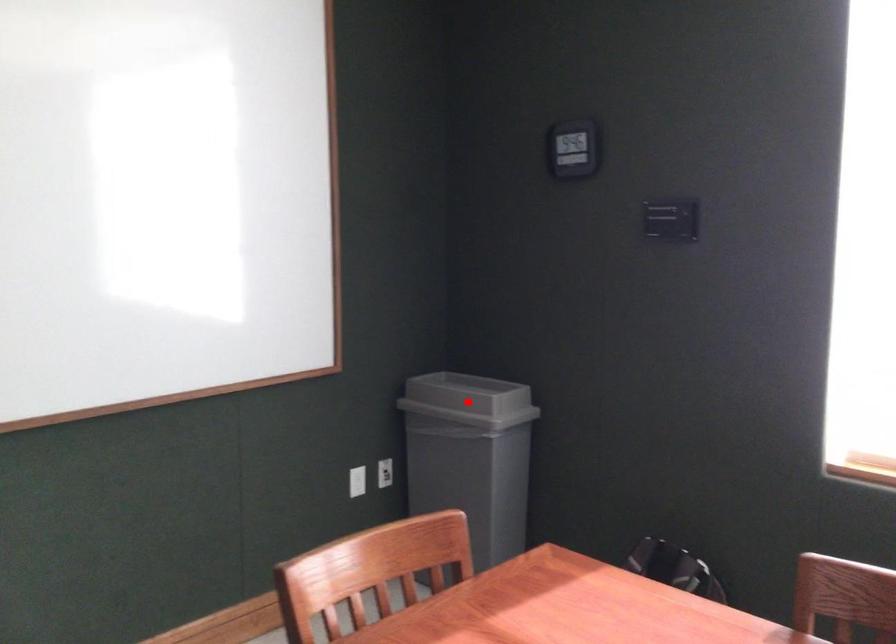
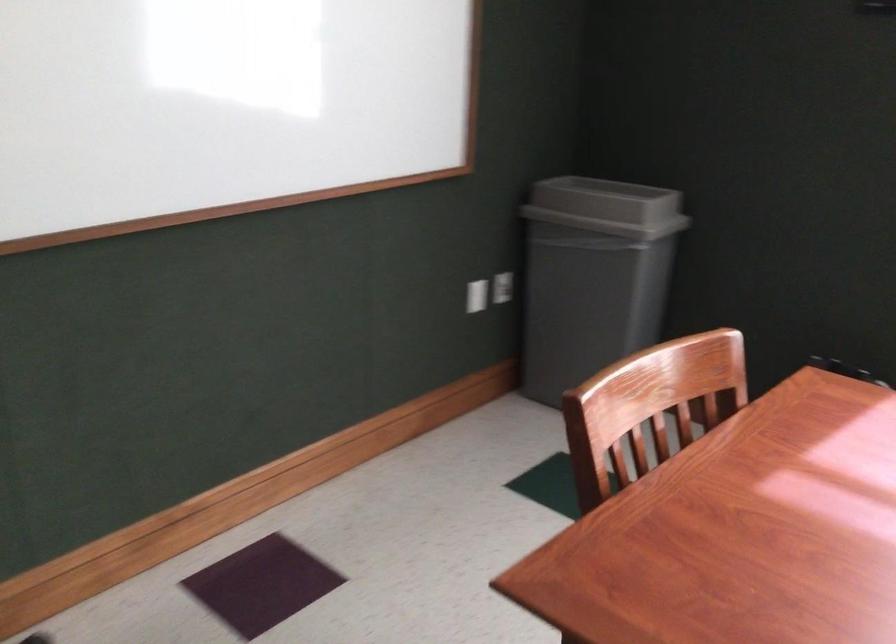
Question: I am providing you with two images of the same scene from different viewpoints. Given a red point in image1, look at the same physical point in image2. Is it:

Choices:
 (A) Closer to the viewpoint
 (B) Farther from the viewpoint

Answer: (A)